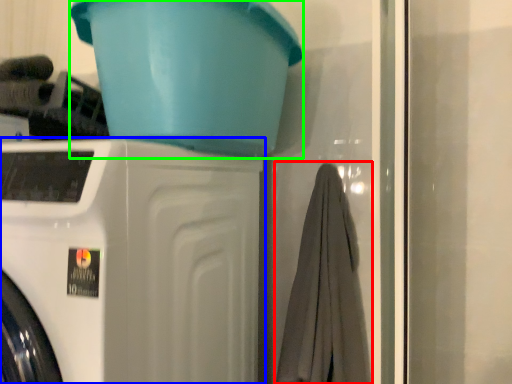
Question: Which object is the closest to the bath towel (highlighted by a red box)? Choose among these: washing machine (highlighted by a blue box) or basin (highlighted by a green box).

Choices:
 (A) washing machine
 (B) basin

Answer: (A)